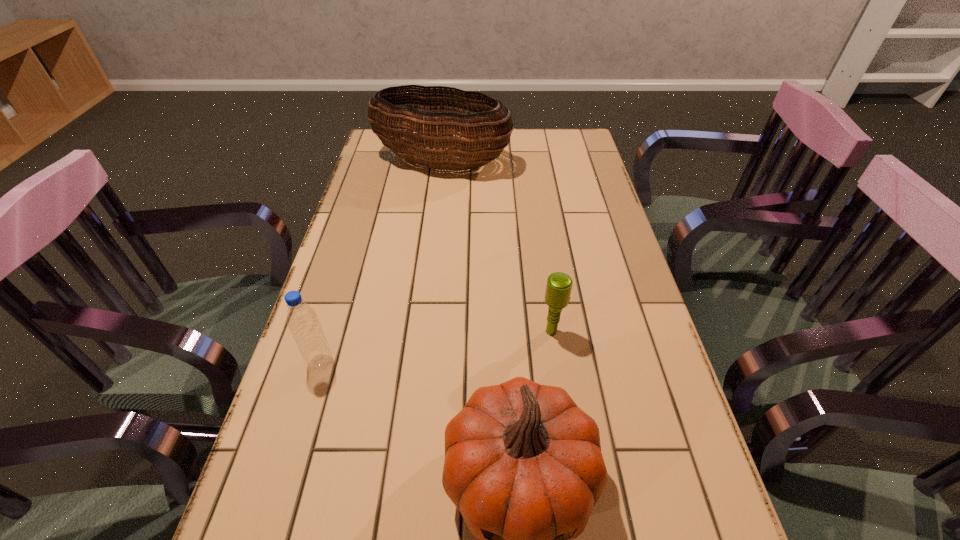
Locate an element on the screen. This screenshot has width=960, height=540. object at the far left corner is located at coordinates (435, 128).

In the image, there is a desktop. Find the location of `vacant space at the left edge`. vacant space at the left edge is located at coordinates click(x=368, y=245).

The width and height of the screenshot is (960, 540). In the image, there is a desktop. Find the location of `vacant space at the right edge`. vacant space at the right edge is located at coordinates (619, 247).

You are a GUI agent. You are given a task and a screenshot of the screen. Output one action in this format:
    pyautogui.click(x=<x>, y=<y>)
    Task: Click on the vacant position at the far left corner of the desktop
    
    Given the screenshot: What is the action you would take?
    pyautogui.click(x=385, y=159)

This screenshot has height=540, width=960. Find the location of `vacant point at the far right corner`. vacant point at the far right corner is located at coordinates (559, 145).

This screenshot has height=540, width=960. In order to click on vacant space that's between the third nearest object and the farthest object in this screenshot , I will do `click(497, 247)`.

Locate an element on the screen. free space between the basket and the water bottle is located at coordinates (381, 262).

Find the location of `object that is the closest to the water bottle`. object that is the closest to the water bottle is located at coordinates (523, 464).

Locate which object ranks in proximity to the basket. Please provide its 2D coordinates. Your answer should be formatted as a tuple, i.e. [(x, y)], where the tuple contains the x and y coordinates of a point satisfying the conditions above.

[(558, 289)]

At what (x,y) coordinates should I click in order to perform the action: click on vacant area in the image that satisfies the following two spatial constraints: 1. on the front side of the basket; 2. on the right side of the microphone. Please return your answer as a coordinate pair (x, y). The width and height of the screenshot is (960, 540). Looking at the image, I should click on (422, 332).